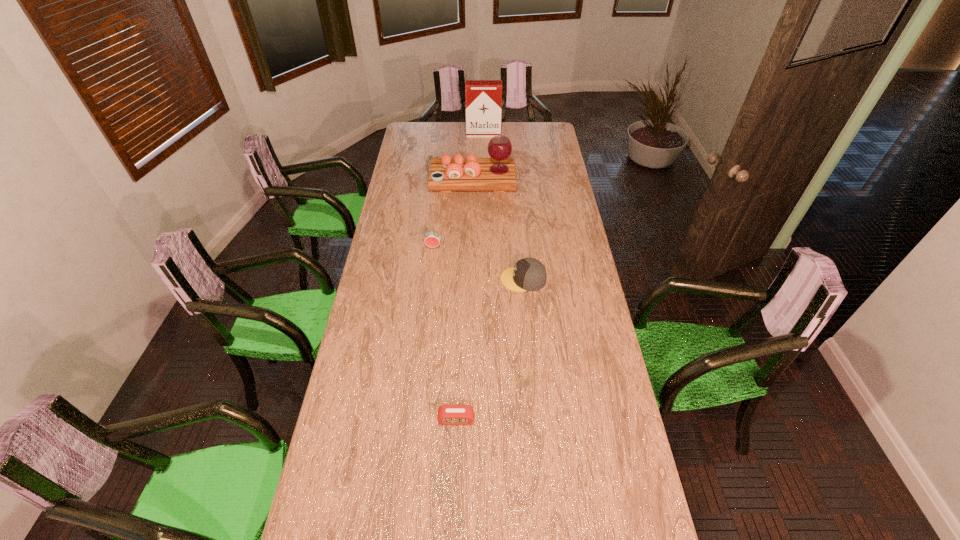
Image resolution: width=960 pixels, height=540 pixels. Find the location of `free point that satisfies the following two spatial constraints: 1. on the front-facing side of the second shortest object; 2. on the front-facing side of the shorter alarm clock`. free point that satisfies the following two spatial constraints: 1. on the front-facing side of the second shortest object; 2. on the front-facing side of the shorter alarm clock is located at coordinates (537, 419).